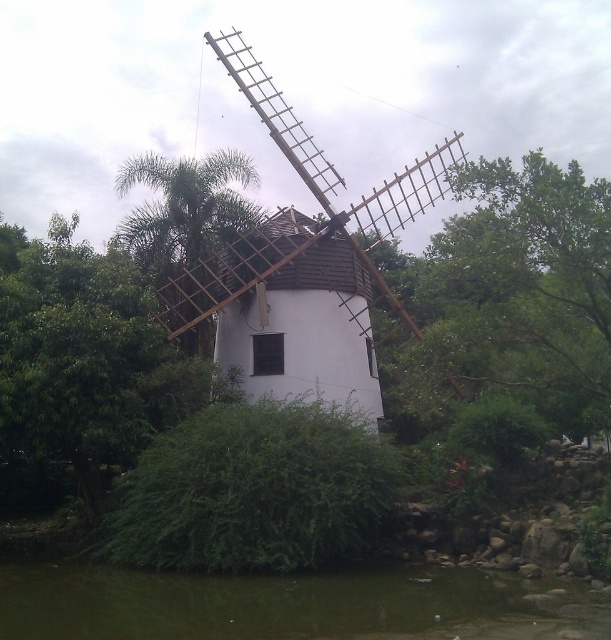
You are a bird looking for a place to perch. You see the green leafy tree at left and the green murky water at lower center. Which location offers a larger area to land on?

The green leafy tree at left is bigger than the green murky water at lower center, so the green leafy tree at left offers a larger area to land on.

You are standing in the scene and want to walk from the green leafy tree at upper right to the green murky water at lower center. Which direction should you move to reach the water?

You should move to the left to reach the green murky water at lower center because the green leafy tree at upper right is located to the right of the green murky water at lower center.

You are standing in the middle of a field looking at the scene. There is a point marked at coordinates point (302, 264). What object is located at that point?

The point (302, 264) indicates the white wooden windmill at center.